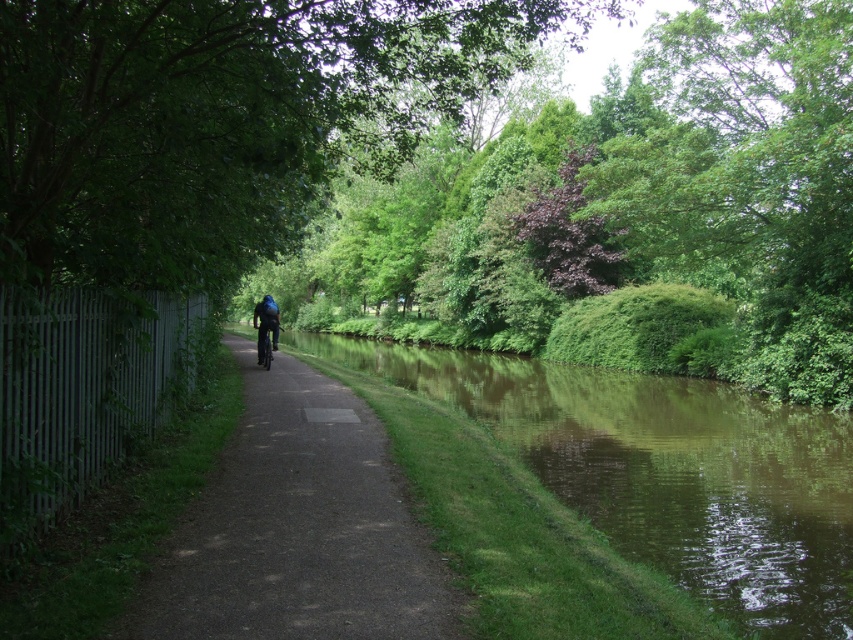
Question: Can you confirm if green reflective water at center is thinner than shiny metallic bicycle at center?

Choices:
 (A) yes
 (B) no

Answer: (B)

Question: Is green leafy tree at center to the left of green reflective water at center from the viewer's perspective?

Choices:
 (A) no
 (B) yes

Answer: (A)

Question: Which point is farther to the camera?

Choices:
 (A) (817, 560)
 (B) (99, 19)

Answer: (A)

Question: Can you confirm if dark asphalt path at center is thinner than shiny metallic bicycle at center?

Choices:
 (A) yes
 (B) no

Answer: (B)

Question: Which point appears farthest from the camera in this image?

Choices:
 (A) click(761, 602)
 (B) click(138, 592)

Answer: (A)

Question: Which point appears closest to the camera in this image?

Choices:
 (A) (802, 461)
 (B) (312, 20)
 (C) (268, 332)
 (D) (608, 170)

Answer: (B)